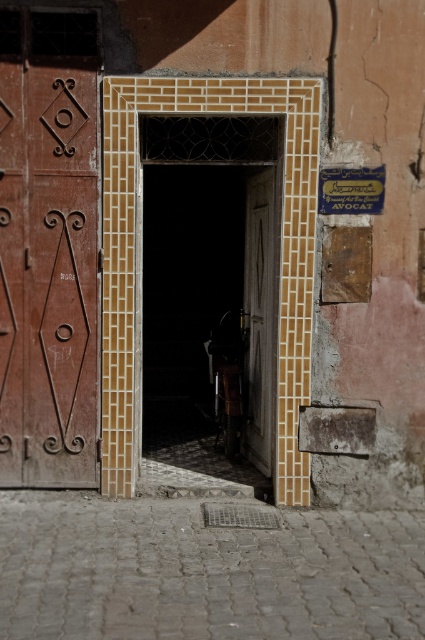
Is matte wooden door at center above wooden carved door at left?

Actually, matte wooden door at center is below wooden carved door at left.

Can you confirm if matte wooden door at center is positioned to the right of wooden carved door at left?

Indeed, matte wooden door at center is positioned on the right side of wooden carved door at left.

Between point (161, 436) and point (61, 440), which one is positioned in front?

Point (61, 440) is in front.

I want to click on matte wooden door at center, so click(209, 292).